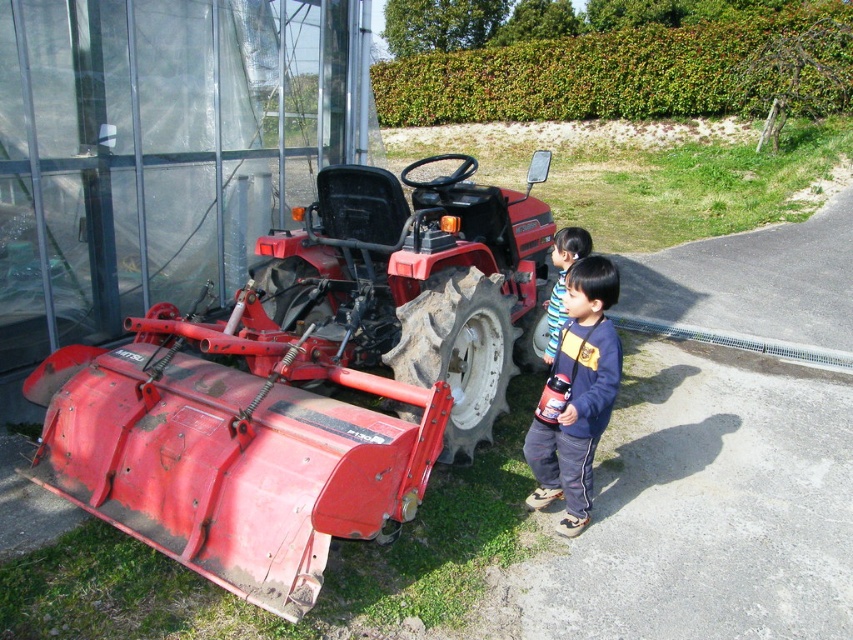
From the picture: Does striped shirt at center have a greater height compared to glossy plastic bottle at lower right?

Yes, striped shirt at center is taller than glossy plastic bottle at lower right.

Is striped shirt at center above glossy plastic bottle at lower right?

Yes, striped shirt at center is above glossy plastic bottle at lower right.

Locate an element on the screen. This screenshot has height=640, width=853. striped shirt at center is located at coordinates (561, 280).

Between red matte tractor at center and blue cotton shirt at lower right, which one has more height?

red matte tractor at center

Which is more to the right, red matte tractor at center or blue cotton shirt at lower right?

blue cotton shirt at lower right

The height and width of the screenshot is (640, 853). I want to click on red matte tractor at center, so click(x=305, y=381).

Where is `red matte tractor at center`? This screenshot has height=640, width=853. red matte tractor at center is located at coordinates (305, 381).

Who is positioned more to the right, blue cotton shirt at lower right or glossy plastic bottle at lower right?

Positioned to the right is blue cotton shirt at lower right.

Looking at this image, is blue cotton shirt at lower right thinner than glossy plastic bottle at lower right?

No.

Is point (532, 468) less distant than point (556, 388)?

No.

Locate an element on the screen. The width and height of the screenshot is (853, 640). blue cotton shirt at lower right is located at coordinates (576, 396).